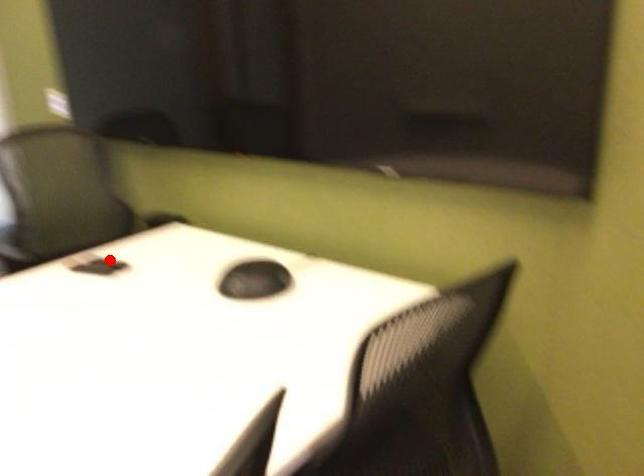
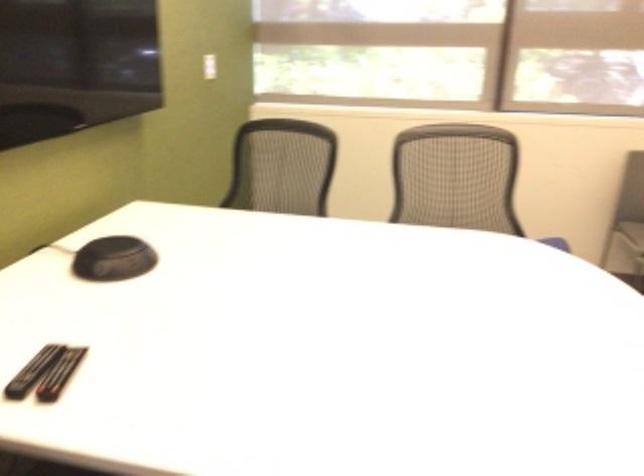
Question: A red point is marked in image1. In image2, is the corresponding 3D point closer to the camera or farther? Reply with the corresponding letter.

Choices:
 (A) The corresponding 3D point is closer.
 (B) The corresponding 3D point is farther.

Answer: (A)